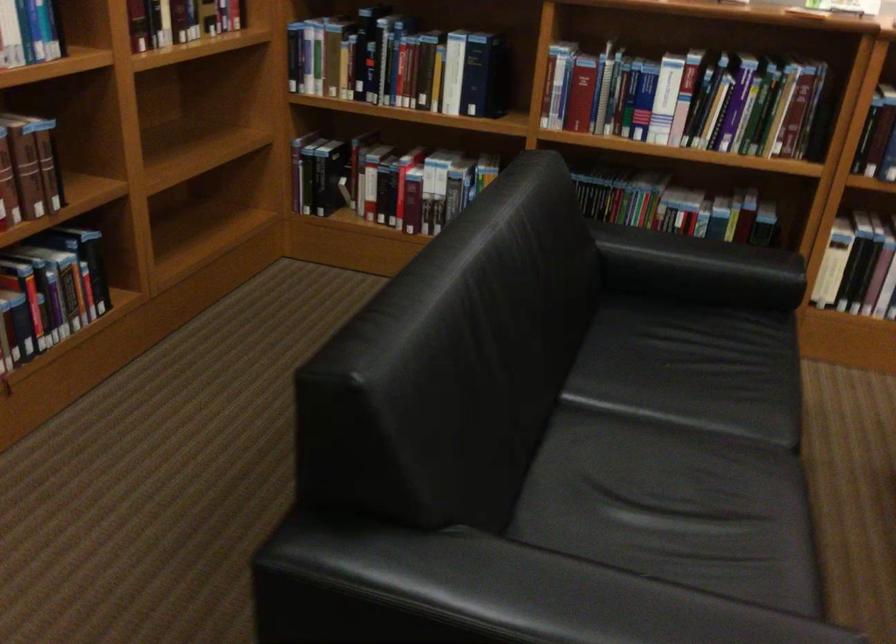
This screenshot has height=644, width=896. What do you see at coordinates (698, 269) in the screenshot? I see `the black sofa armrest` at bounding box center [698, 269].